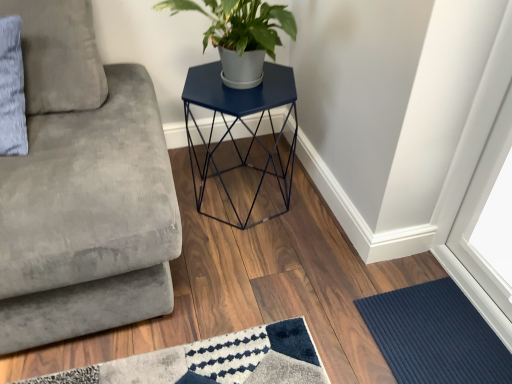
Question: In the image, is gray fabric pillow at upper left positioned in front of or behind matte blue hexagonal table at center?

Choices:
 (A) front
 (B) behind

Answer: (A)

Question: Would you say gray fabric pillow at upper left is inside or outside matte blue hexagonal table at center?

Choices:
 (A) inside
 (B) outside

Answer: (B)

Question: Considering the real-world distances, which object is closest to the velvet gray studio couch at left?

Choices:
 (A) matte blue hexagonal table at center
 (B) gray fabric pillow at upper left
 (C) navy blue ribbed mat at lower right

Answer: (B)

Question: Which object is the closest to the velvet gray studio couch at left?

Choices:
 (A) gray fabric pillow at upper left
 (B) navy blue ribbed mat at lower right
 (C) matte blue hexagonal table at center

Answer: (A)